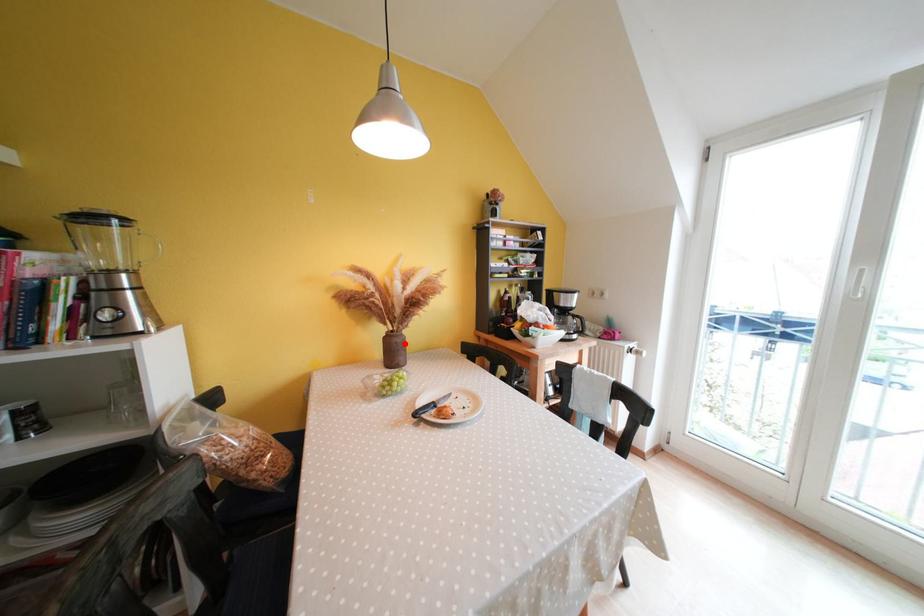
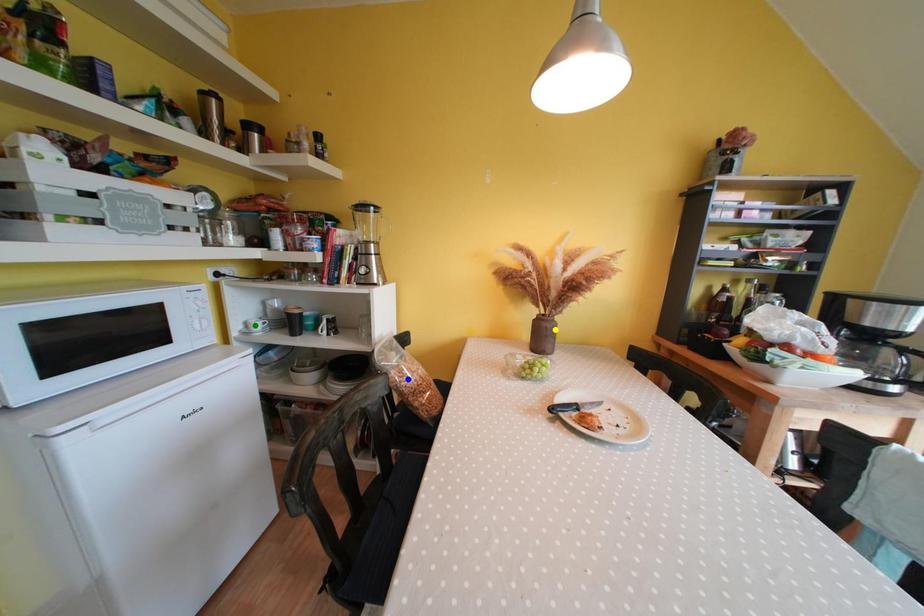
Question: I am providing you with two images of the same scene from different viewpoints. A red point is marked on the first image. You are given multiple points on the second image. Can you choose the point in image 2 that corresponds to the point in image 1?

Choices:
 (A) blue point
 (B) green point
 (C) yellow point

Answer: (C)